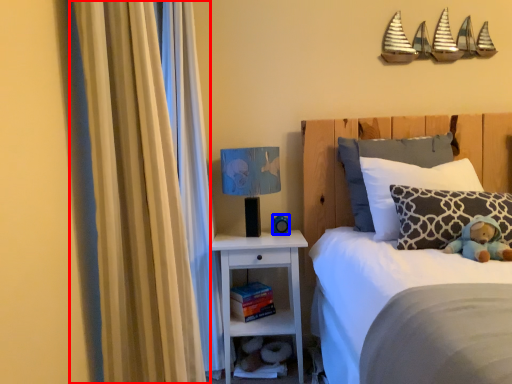
Question: Which point is further to the camera, curtain (highlighted by a red box) or toy (highlighted by a blue box)?

Choices:
 (A) curtain
 (B) toy

Answer: (B)